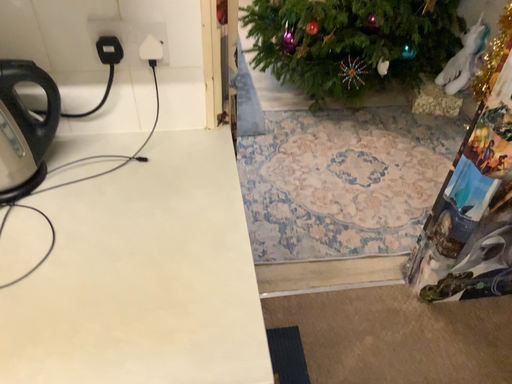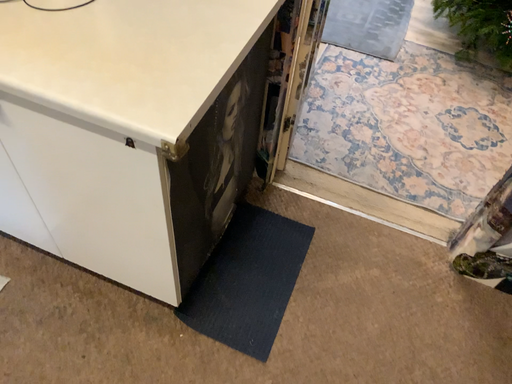
Question: How did the camera likely rotate when shooting the video?

Choices:
 (A) rotated left
 (B) rotated right

Answer: (A)